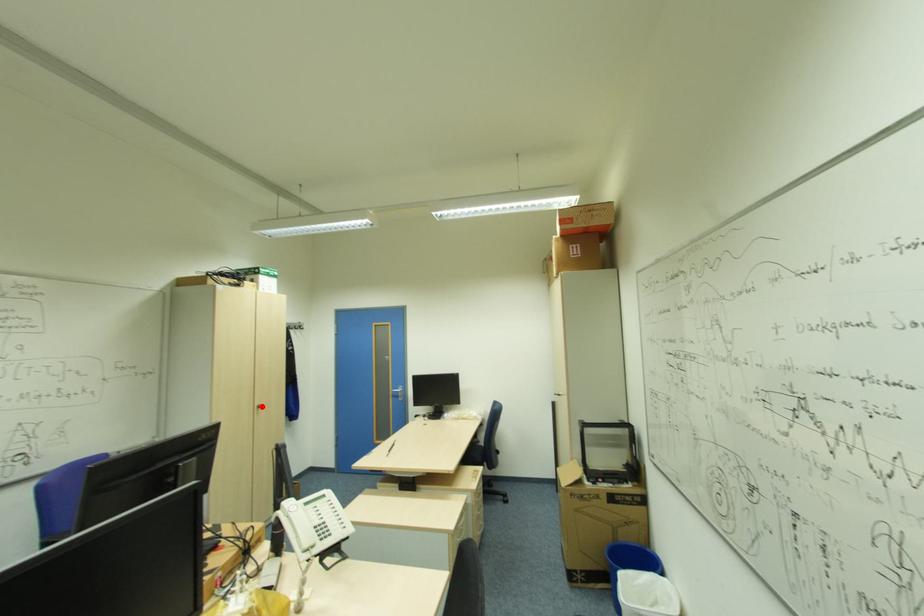
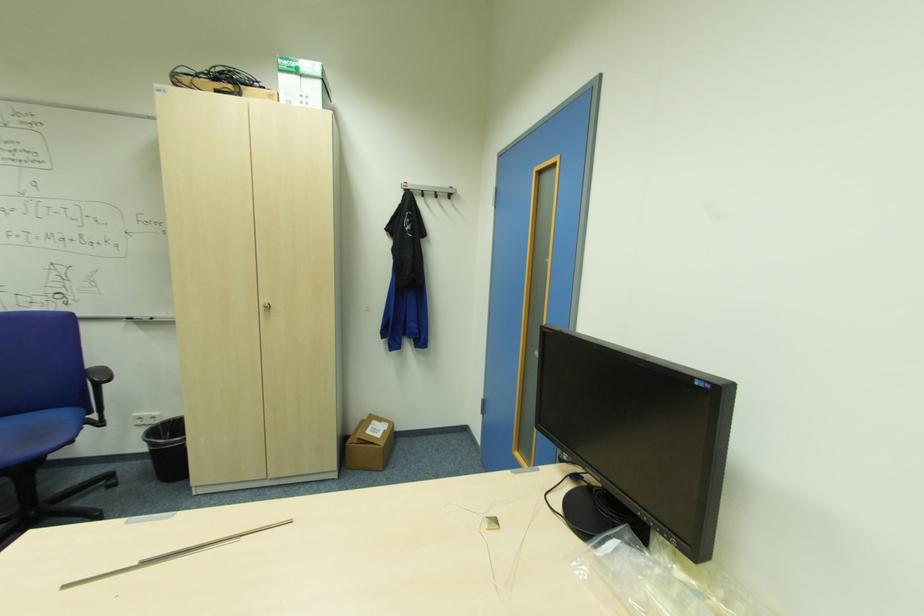
Question: I am providing you with two images of the same scene from different viewpoints. Given a red point in image1, look at the same physical point in image2. Is it:

Choices:
 (A) Closer to the viewpoint
 (B) Farther from the viewpoint

Answer: (B)